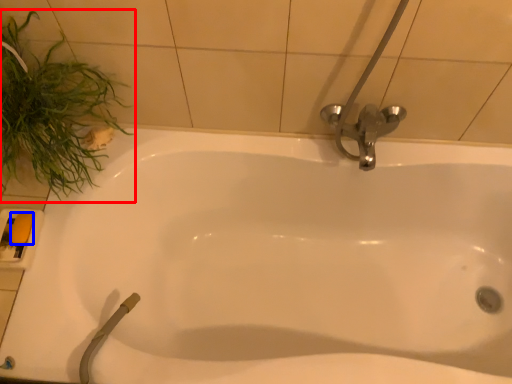
Question: Which point is closer to the camera, plant (highlighted by a red box) or soap (highlighted by a blue box)?

Choices:
 (A) plant
 (B) soap

Answer: (A)